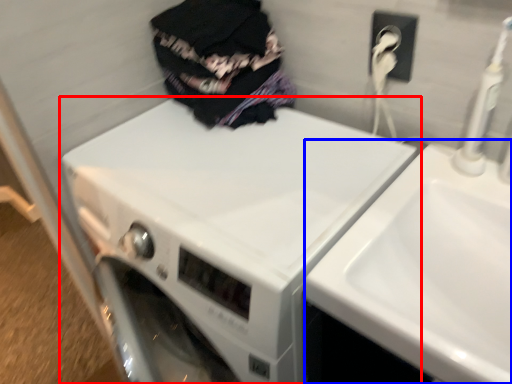
Question: Which object is further to the camera taking this photo, washing machine (highlighted by a red box) or sink (highlighted by a blue box)?

Choices:
 (A) washing machine
 (B) sink

Answer: (A)